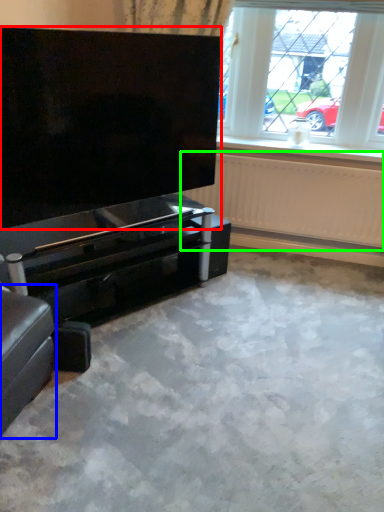
Question: Considering the real-world distances, which object is farthest from screen (highlighted by a red box)? furniture (highlighted by a blue box) or radiator (highlighted by a green box)?

Choices:
 (A) furniture
 (B) radiator

Answer: (B)